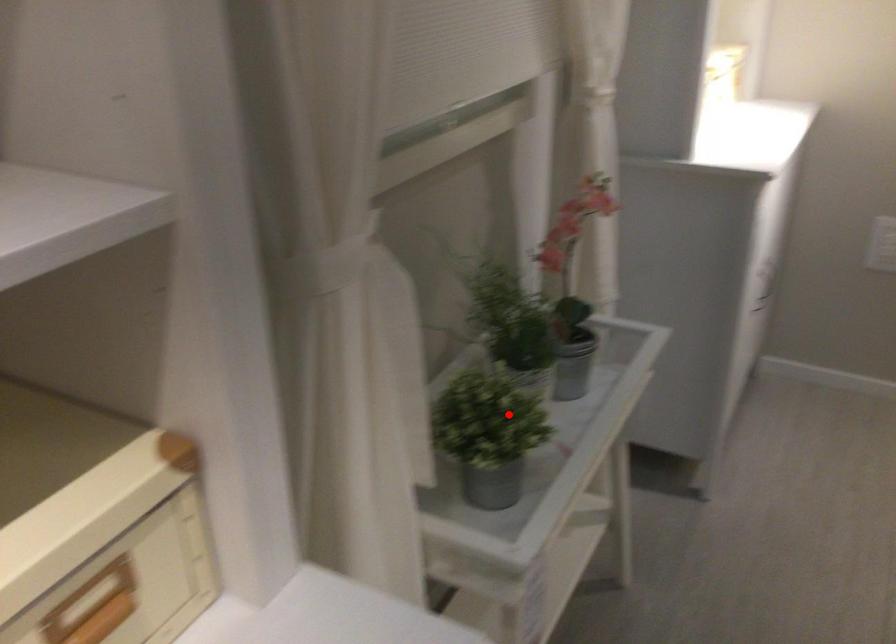
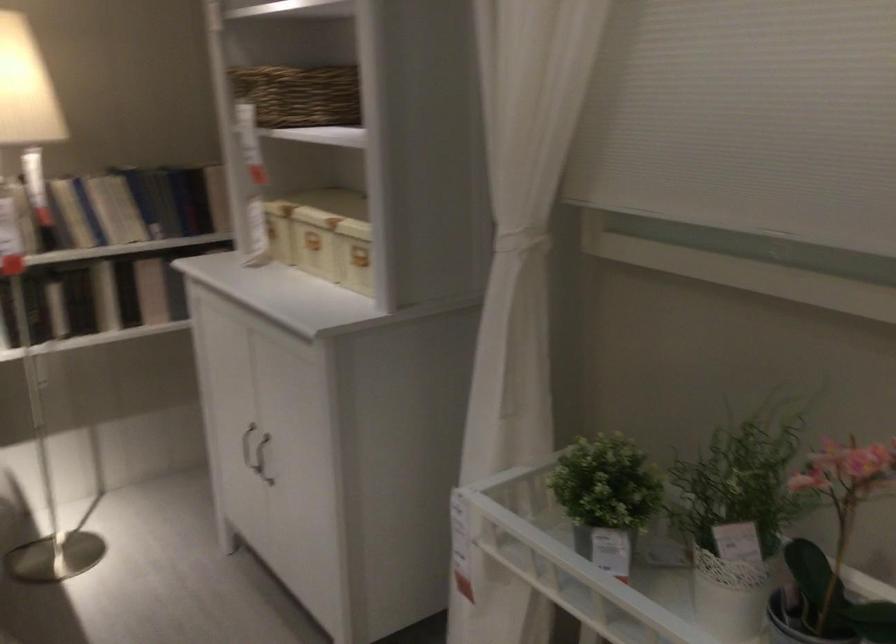
Where in the second image is the point corresponding to the highlighted location from the first image?

(606, 498)